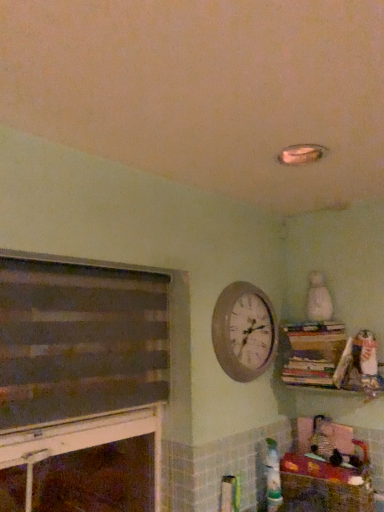
Describe the element at coordinates (316, 354) in the screenshot. This screenshot has height=512, width=384. I see `wooden bookshelf at upper right` at that location.

Locate an element on the screen. wooden wall clock at upper center is located at coordinates (244, 331).

Describe the element at coordinates (93, 362) in the screenshot. I see `dark gray matte fireplace at left` at that location.

I want to click on dark gray matte fireplace at left, so click(93, 362).

Describe the element at coordinates (323, 486) in the screenshot. I see `wooden crate at lower right` at that location.

Find the location of a particular element. The width and height of the screenshot is (384, 512). wooden bookshelf at upper right is located at coordinates (316, 354).

Does wooden crate at lower right turn towards dark gray matte fireplace at left?

No.

Considering the relative positions of wooden crate at lower right and dark gray matte fireplace at left in the image provided, is wooden crate at lower right behind dark gray matte fireplace at left?

Yes, wooden crate at lower right is further from the viewer.

From the image's perspective, relative to dark gray matte fireplace at left, is wooden crate at lower right above or below?

From the image's perspective, wooden crate at lower right appears below dark gray matte fireplace at left.

The image size is (384, 512). What are the coordinates of `toy behind the wooden wall clock at upper center` in the screenshot? It's located at (318, 298).

Is point (322, 282) closer or farther from the camera than point (222, 332)?

Point (322, 282) is farther from the camera than point (222, 332).

Is white plush bear at upper right smaller than wooden wall clock at upper center?

Indeed, white plush bear at upper right has a smaller size compared to wooden wall clock at upper center.

Could you tell me if white plush bear at upper right is turned towards wooden wall clock at upper center?

No.

Considering the positions of point (313, 307) and point (36, 331), is point (313, 307) closer or farther from the camera than point (36, 331)?

Point (313, 307) is positioned farther from the camera compared to point (36, 331).

Consider the image. Is white plush bear at upper right located outside dark gray matte fireplace at left?

Yes, white plush bear at upper right is located beyond the bounds of dark gray matte fireplace at left.

Based on the photo, is white plush bear at upper right taller than dark gray matte fireplace at left?

Incorrect, the height of white plush bear at upper right is not larger of that of dark gray matte fireplace at left.

Looking at the image, does white plush bear at upper right seem bigger or smaller compared to dark gray matte fireplace at left?

Clearly, white plush bear at upper right is smaller in size than dark gray matte fireplace at left.

Considering the points (316, 272) and (335, 373), which point is behind, point (316, 272) or point (335, 373)?

Positioned behind is point (316, 272).

Is white plush bear at upper right positioned far away from wooden bookshelf at upper right?

That's not correct — white plush bear at upper right is a little close to wooden bookshelf at upper right.

Considering the relative positions of dark gray matte fireplace at left and wooden bookshelf at upper right in the image provided, is dark gray matte fireplace at left to the left or to the right of wooden bookshelf at upper right?

Clearly, dark gray matte fireplace at left is on the left of wooden bookshelf at upper right in the image.

Measure the distance between dark gray matte fireplace at left and wooden bookshelf at upper right.

33.67 inches.

Considering the relative sizes of dark gray matte fireplace at left and wooden bookshelf at upper right in the image provided, is dark gray matte fireplace at left taller than wooden bookshelf at upper right?

Yes.

Can we say dark gray matte fireplace at left lies outside wooden bookshelf at upper right?

Yes, dark gray matte fireplace at left is outside of wooden bookshelf at upper right.

What's the angular difference between dark gray matte fireplace at left and wooden crate at lower right's facing directions?

The angular difference between dark gray matte fireplace at left and wooden crate at lower right is 89.6 degrees.

There is a wooden crate at lower right. In order to click on fireplace above it (from a real-world perspective) in this screenshot , I will do `click(93, 362)`.

Is the depth of dark gray matte fireplace at left less than that of wooden crate at lower right?

Yes, it is in front of wooden crate at lower right.

From a real-world perspective, is dark gray matte fireplace at left on wooden crate at lower right?

Yes, from a real-world perspective, dark gray matte fireplace at left is above wooden crate at lower right.

Considering their positions, is wooden wall clock at upper center located in front of or behind dark gray matte fireplace at left?

Clearly, wooden wall clock at upper center is behind dark gray matte fireplace at left.

Between wooden wall clock at upper center and dark gray matte fireplace at left, which one has smaller size?

With smaller size is wooden wall clock at upper center.

In the scene shown: Is wooden wall clock at upper center turned away from dark gray matte fireplace at left?

No, dark gray matte fireplace at left is not at the back of wooden wall clock at upper center.

At what (x,y) coordinates should I click in order to perform the action: click on wall clock above the dark gray matte fireplace at left (from the image's perspective). Please return your answer as a coordinate pair (x, y). The height and width of the screenshot is (512, 384). Looking at the image, I should click on click(244, 331).

The height and width of the screenshot is (512, 384). Identify the location of crate below the dark gray matte fireplace at left (from the image's perspective). (323, 486).

This screenshot has height=512, width=384. Identify the location of toy located behind the wooden wall clock at upper center. (318, 298).

Which object lies further to the anchor point white plush bear at upper right, wooden crate at lower right or wooden bookshelf at upper right?

wooden crate at lower right lies further to white plush bear at upper right than the other object.

From the image, which object appears to be nearer to white plush bear at upper right, wooden bookshelf at upper right or dark gray matte fireplace at left?

wooden bookshelf at upper right.

Based on their spatial positions, is wooden wall clock at upper center or wooden crate at lower right closer to wooden bookshelf at upper right?

The object closer to wooden bookshelf at upper right is wooden wall clock at upper center.

Which object lies further to the anchor point wooden bookshelf at upper right, wooden crate at lower right or wooden wall clock at upper center?

The object further to wooden bookshelf at upper right is wooden crate at lower right.

When comparing their distances from wooden crate at lower right, does wooden wall clock at upper center or dark gray matte fireplace at left seem closer?

wooden wall clock at upper center lies closer to wooden crate at lower right than the other object.

Considering their positions, is wooden crate at lower right positioned closer to dark gray matte fireplace at left than white plush bear at upper right?

Based on the image, wooden crate at lower right appears to be nearer to dark gray matte fireplace at left.

From the image, which object appears to be farther from white plush bear at upper right, wooden bookshelf at upper right or wooden crate at lower right?

wooden crate at lower right is positioned further to the anchor white plush bear at upper right.

When comparing their distances from wooden crate at lower right, does wooden bookshelf at upper right or white plush bear at upper right seem closer?

Based on the image, wooden bookshelf at upper right appears to be nearer to wooden crate at lower right.

The image size is (384, 512). Identify the location of bookcase between white plush bear at upper right and wooden crate at lower right vertically. (316, 354).

Locate an element on the screen. crate situated between dark gray matte fireplace at left and white plush bear at upper right from left to right is located at coordinates (323, 486).

At what (x,y) coordinates should I click in order to perform the action: click on wall clock that lies between white plush bear at upper right and wooden crate at lower right from top to bottom. Please return your answer as a coordinate pair (x, y). The image size is (384, 512). Looking at the image, I should click on (244, 331).

Where is `bookcase between dark gray matte fireplace at left and white plush bear at upper right from left to right`? The image size is (384, 512). bookcase between dark gray matte fireplace at left and white plush bear at upper right from left to right is located at coordinates (316, 354).